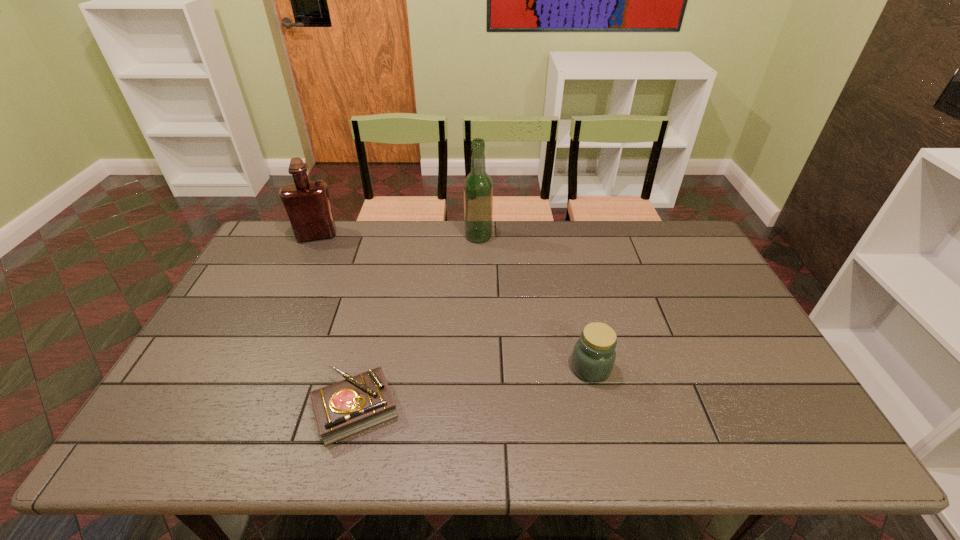
Locate an element on the screen. The image size is (960, 540). free point between the second shortest object and the shortest object is located at coordinates tap(473, 388).

This screenshot has height=540, width=960. I want to click on object that is the second closest to the third tallest object, so click(x=478, y=187).

Find the location of a particular element. This screenshot has height=540, width=960. object that is the closest one to the tallest object is located at coordinates (307, 203).

Where is `free spot that satisfies the following two spatial constraints: 1. on the front side of the shortest object; 2. on the left side of the leftmost object`? The image size is (960, 540). free spot that satisfies the following two spatial constraints: 1. on the front side of the shortest object; 2. on the left side of the leftmost object is located at coordinates (233, 409).